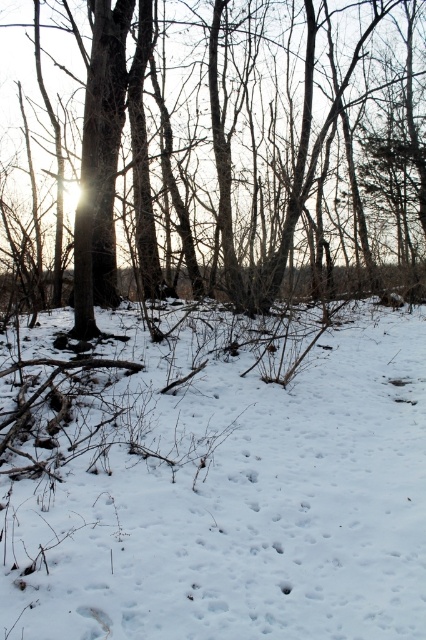
You are an animal trying to find shelter from the cold. You see the white powdery snow at center and the brown rough tree at center. Which location would provide better insulation against the cold?

The white powdery snow at center is below the brown rough tree at center, so the snow at center would provide better insulation against the cold as snow is known to insulate and retain heat.

You are a hiker who needs to cross a forest path. You see the white powdery snow at center and the brown rough tree at center. How far apart are these two landmarks?

The distance between the white powdery snow at center and the brown rough tree at center is 11.84 meters.

You are standing at the origin point in the winter forest scene. You see two points marked in the image. Which point is closer to you, point [307,464] or point [48,269]?

Point [307,464] is in front of point [48,269], so it is closer to you.